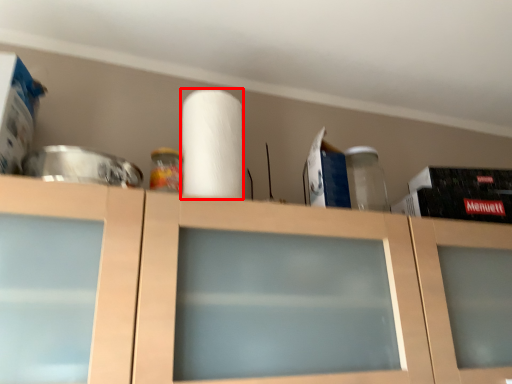
Question: From the image's perspective, what is the correct spatial relationship of paper towel (annotated by the red box) in relation to cabinetry?

Choices:
 (A) below
 (B) above

Answer: (B)